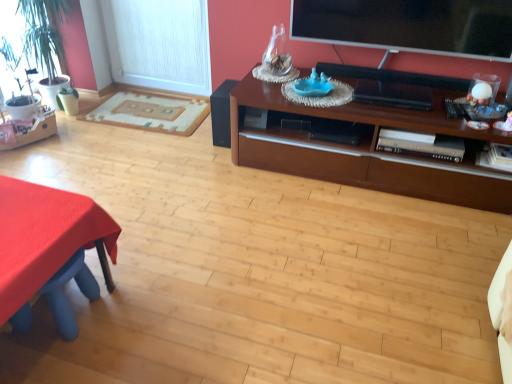
Image resolution: width=512 pixels, height=384 pixels. What do you see at coordinates (222, 113) in the screenshot? I see `matte black speaker at center` at bounding box center [222, 113].

The image size is (512, 384). What do you see at coordinates (369, 146) in the screenshot?
I see `brown wood cabinet at upper right` at bounding box center [369, 146].

The image size is (512, 384). Describe the element at coordinates (159, 43) in the screenshot. I see `white textured window screen at left` at that location.

This screenshot has width=512, height=384. Identify the location of matte black speaker at center. (222, 113).

Which is less distant, [298,16] or [270,126]?

Point [298,16] is positioned farther from the camera compared to point [270,126].

The image size is (512, 384). I want to click on cabinetry below the flat screen tv at upper right (from the image's perspective), so click(369, 146).

Is flat screen tv at upper right surrounding brown wood cabinet at upper right?

No.

From the image's perspective, relative to brown wood cabinet at upper right, is flat screen tv at upper right above or below?

Clearly, from the image's perspective, flat screen tv at upper right is above brown wood cabinet at upper right.

Is point (125, 109) farther from viewer compared to point (510, 51)?

Yes, point (125, 109) is farther from viewer.

Consider the image. Does beige woven rug at left have a larger size compared to flat screen tv at upper right?

Incorrect, beige woven rug at left is not larger than flat screen tv at upper right.

Is beige woven rug at left far from flat screen tv at upper right?

Yes.

Is beige woven rug at left wider than flat screen tv at upper right?

Yes, beige woven rug at left is wider than flat screen tv at upper right.

How different are the orientations of beige woven rug at left and brown wood cabinet at upper right in degrees?

2.6 degrees.

From a real-world perspective, which is physically above, beige woven rug at left or brown wood cabinet at upper right?

brown wood cabinet at upper right is physically above.

Is beige woven rug at left not close to brown wood cabinet at upper right?

beige woven rug at left is positioned a significant distance from brown wood cabinet at upper right.

Considering the relative sizes of beige woven rug at left and brown wood cabinet at upper right in the image provided, is beige woven rug at left smaller than brown wood cabinet at upper right?

Yes, beige woven rug at left is smaller than brown wood cabinet at upper right.

In the image, there is a green leafy plant at left. Where is `window screen above it (from the image's perspective)`? Image resolution: width=512 pixels, height=384 pixels. window screen above it (from the image's perspective) is located at coordinates (159, 43).

Is green leafy plant at left aimed at white textured window screen at left?

No.

Considering the relative sizes of green leafy plant at left and white textured window screen at left in the image provided, is green leafy plant at left taller than white textured window screen at left?

Yes, green leafy plant at left is taller than white textured window screen at left.

How different are the orientations of green leafy plant at left and white textured window screen at left in degrees?

The angular difference between green leafy plant at left and white textured window screen at left is 87.5 degrees.

From a real-world perspective, who is located higher, matte black speaker at center or flat screen tv at upper right?

In real-world perspective, flat screen tv at upper right is above.

Which is behind, point (232, 87) or point (301, 7)?

The point (232, 87) is farther.

From the picture: Is matte black speaker at center further to camera compared to flat screen tv at upper right?

Yes.

Is matte black speaker at center to the right of flat screen tv at upper right from the viewer's perspective?

No, matte black speaker at center is not to the right of flat screen tv at upper right.

Between white textured window screen at left and red fabric table at lower left, which one has smaller size?

With smaller size is red fabric table at lower left.

Can you confirm if white textured window screen at left is shorter than red fabric table at lower left?

No, white textured window screen at left is not shorter than red fabric table at lower left.

Is point (155, 52) closer or farther from the camera than point (0, 191)?

Point (155, 52).

Consider the image. Considering the sizes of objects white textured window screen at left and red fabric table at lower left in the image provided, who is thinner, white textured window screen at left or red fabric table at lower left?

With smaller width is white textured window screen at left.

Locate an element on the screen. television above the matte black speaker at center (from a real-world perspective) is located at coordinates pos(410,25).

Is flat screen tv at upper right thinner than matte black speaker at center?

Yes, flat screen tv at upper right is thinner than matte black speaker at center.

Does flat screen tv at upper right appear on the left side of matte black speaker at center?

No, flat screen tv at upper right is not to the left of matte black speaker at center.

Is flat screen tv at upper right positioned far away from matte black speaker at center?

flat screen tv at upper right is actually quite close to matte black speaker at center.

Locate an element on the screen. cabinetry that appears in front of the flat screen tv at upper right is located at coordinates (369, 146).

This screenshot has width=512, height=384. Identify the location of television on the right side of beige woven rug at left. (410, 25).

Considering their positions, is brown wood cabinet at upper right positioned further to matte black speaker at center than flat screen tv at upper right?

flat screen tv at upper right is positioned further to the anchor matte black speaker at center.

From the image, which object appears to be nearer to matte black speaker at center, white textured window screen at left or flat screen tv at upper right?

white textured window screen at left is closer to matte black speaker at center.

Based on their spatial positions, is brown wood cabinet at upper right or flat screen tv at upper right closer to red fabric table at lower left?

brown wood cabinet at upper right is positioned closer to the anchor red fabric table at lower left.

When comparing their distances from green leafy plant at left, does brown wood cabinet at upper right or white textured window screen at left seem closer?

Based on the image, white textured window screen at left appears to be nearer to green leafy plant at left.

Based on their spatial positions, is red fabric table at lower left or green leafy plant at left further from brown wood cabinet at upper right?

Among the two, green leafy plant at left is located further to brown wood cabinet at upper right.

Which object lies further to the anchor point beige woven rug at left, white textured window screen at left or brown wood cabinet at upper right?

brown wood cabinet at upper right is positioned further to the anchor beige woven rug at left.

Which object lies nearer to the anchor point matte black speaker at center, red fabric table at lower left or beige woven rug at left?

beige woven rug at left.

When comparing their distances from matte black speaker at center, does flat screen tv at upper right or brown wood cabinet at upper right seem further?

flat screen tv at upper right lies further to matte black speaker at center than the other object.

Locate an element on the screen. desk between green leafy plant at left and flat screen tv at upper right is located at coordinates [46, 237].

At what (x,y) coordinates should I click in order to perform the action: click on flat between green leafy plant at left and white textured window screen at left. Please return your answer as a coordinate pair (x, y). The image size is (512, 384). Looking at the image, I should click on (150, 112).

Locate an element on the screen. cabinetry located between green leafy plant at left and flat screen tv at upper right in the left-right direction is located at coordinates (369, 146).

This screenshot has height=384, width=512. Find the location of `window screen between green leafy plant at left and matte black speaker at center in the horizontal direction`. window screen between green leafy plant at left and matte black speaker at center in the horizontal direction is located at coordinates (159, 43).